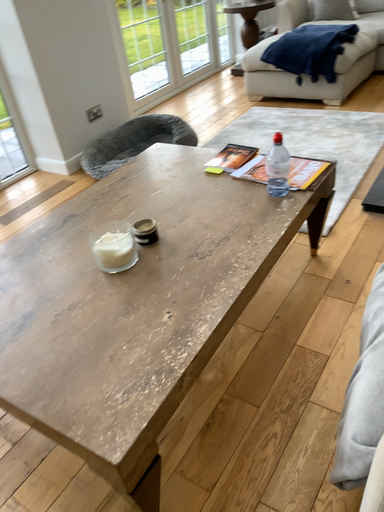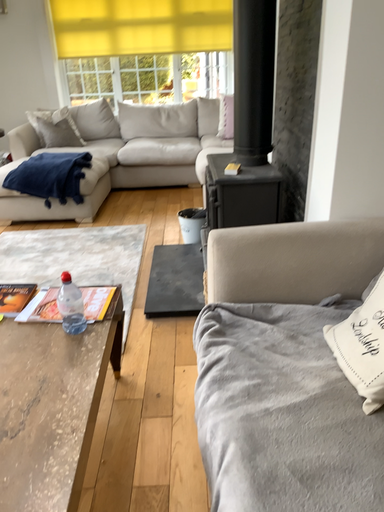
Question: How did the camera likely rotate when shooting the video?

Choices:
 (A) rotated upward
 (B) rotated downward

Answer: (A)